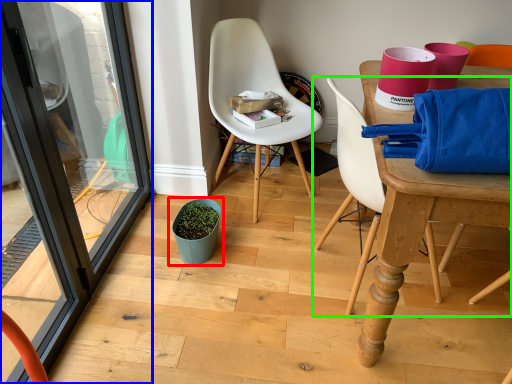
Question: Estimate the real-world distances between objects in this image. Which object is farther from flowerpot (highlighted by a red box), screen door (highlighted by a blue box) or chair (highlighted by a green box)?

Choices:
 (A) screen door
 (B) chair

Answer: (B)